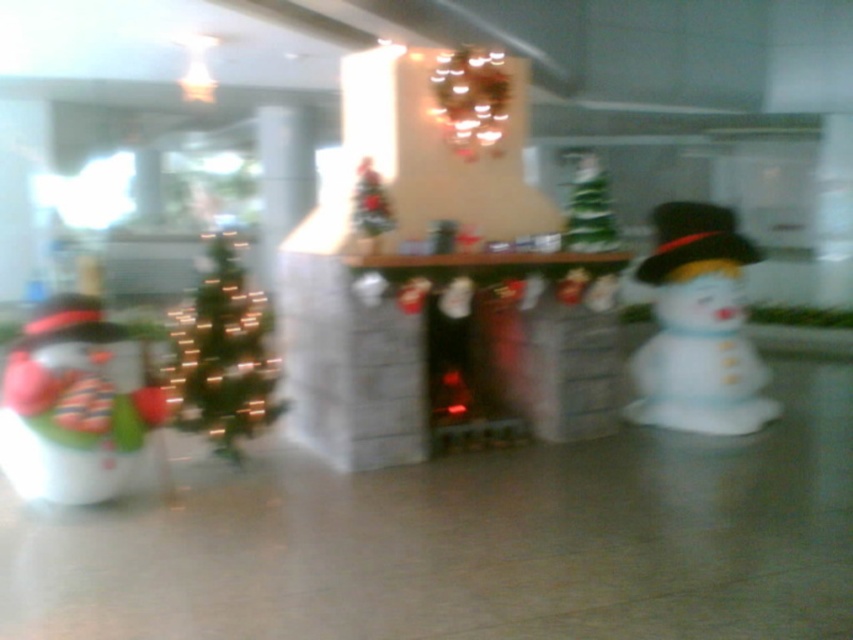
Question: Does white glossy snowman at right have a smaller size compared to green matte christmas tree at left?

Choices:
 (A) yes
 (B) no

Answer: (B)

Question: Which point is farther to the camera?

Choices:
 (A) matte white snowman at left
 (B) green matte christmas tree at center

Answer: (B)

Question: Among these points, which one is farthest from the camera?

Choices:
 (A) [132, 412]
 (B) [675, 400]
 (C) [223, 435]
 (D) [577, 225]

Answer: (B)

Question: Is matte white snowman at left to the right of white glossy snowman at right from the viewer's perspective?

Choices:
 (A) yes
 (B) no

Answer: (B)

Question: Is matte white snowman at left to the right of green matte christmas tree at left from the viewer's perspective?

Choices:
 (A) no
 (B) yes

Answer: (A)

Question: Which of these objects is positioned farthest from the green matte christmas tree at left?

Choices:
 (A) white glossy snowman at right
 (B) matte white snowman at left
 (C) green matte christmas tree at center

Answer: (A)